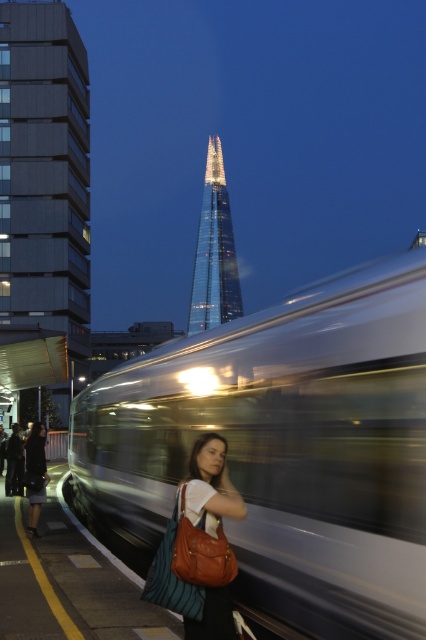
Question: Is brown leather bag at center positioned behind shiny glass tower at center?

Choices:
 (A) yes
 (B) no

Answer: (B)

Question: Is gray concrete building at upper left behind shiny glass tower at center?

Choices:
 (A) yes
 (B) no

Answer: (B)

Question: Which of the following is the closest to the observer?

Choices:
 (A) (221, 307)
 (B) (36, 257)
 (C) (39, 435)

Answer: (C)

Question: Which is nearer to the shiny glass tower at center?

Choices:
 (A) silver metallic train at center
 (B) black fabric skirt at lower left

Answer: (A)

Question: Estimate the real-world distances between objects in this image. Which object is closer to the brown leather bag at center?

Choices:
 (A) gray concrete building at upper left
 (B) black fabric skirt at lower left
 (C) shiny glass tower at center
 (D) silver metallic train at center

Answer: (D)

Question: Is silver metallic train at center thinner than shiny glass tower at center?

Choices:
 (A) yes
 (B) no

Answer: (A)